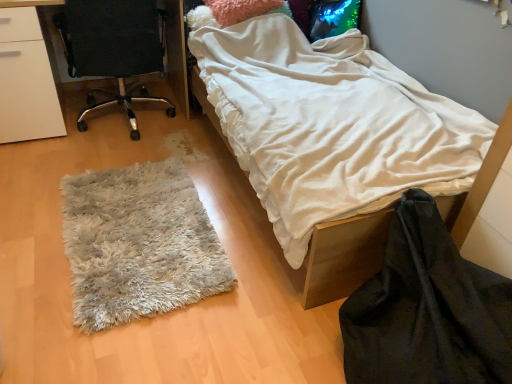
What is the approximate height of white fluffy rug at lower left?

2.91 inches.

Image resolution: width=512 pixels, height=384 pixels. What do you see at coordinates (114, 48) in the screenshot?
I see `black fabric chair at left` at bounding box center [114, 48].

Locate an element on the screen. black velvet blanket at lower right is located at coordinates (426, 310).

Does point (441, 336) lie in front of point (206, 105)?

Yes, it is in front of point (206, 105).

Does black velvet blanket at lower right appear on the left side of white soft blanket at center?

In fact, black velvet blanket at lower right is to the right of white soft blanket at center.

Considering the sizes of objects black velvet blanket at lower right and white soft blanket at center in the image provided, who is thinner, black velvet blanket at lower right or white soft blanket at center?

Thinner between the two is black velvet blanket at lower right.

Looking at this image, which is correct: black velvet blanket at lower right is inside white soft blanket at center, or outside of it?

black velvet blanket at lower right is outside white soft blanket at center.

From a real-world perspective, between white fluffy rug at lower left and white soft blanket at center, who is vertically higher?

From a 3D spatial view, white soft blanket at center is above.

Does white fluffy rug at lower left appear on the right side of white soft blanket at center?

No.

Find the location of a particular element. This screenshot has width=512, height=384. bed above the white fluffy rug at lower left (from a real-world perspective) is located at coordinates (344, 253).

Is black fabric chair at left further to camera compared to black velvet blanket at lower right?

Yes.

Is point (77, 57) farther from camera compared to point (380, 327)?

Yes, it is behind point (380, 327).

Can you confirm if black fabric chair at left is shorter than black velvet blanket at lower right?

No, black fabric chair at left is not shorter than black velvet blanket at lower right.

Is black velvet blanket at lower right inside or outside of black fabric chair at left?

black velvet blanket at lower right is not enclosed by black fabric chair at left.

Which object is closer to the camera taking this photo, black velvet blanket at lower right or black fabric chair at left?

black velvet blanket at lower right is in front.

Is black velvet blanket at lower right thinner than black fabric chair at left?

Yes, black velvet blanket at lower right is thinner than black fabric chair at left.

From the image's perspective, which is below, white fluffy rug at lower left or black velvet blanket at lower right?

black velvet blanket at lower right is shown below in the image.

Considering the positions of objects white fluffy rug at lower left and black velvet blanket at lower right in the image provided, who is behind, white fluffy rug at lower left or black velvet blanket at lower right?

Positioned behind is white fluffy rug at lower left.

Measure the distance from white fluffy rug at lower left to black velvet blanket at lower right.

They are 81.78 centimeters apart.

Is white fluffy rug at lower left bigger than black velvet blanket at lower right?

Incorrect, white fluffy rug at lower left is not larger than black velvet blanket at lower right.

Is black velvet blanket at lower right to the left of white fluffy rug at lower left from the viewer's perspective?

In fact, black velvet blanket at lower right is to the right of white fluffy rug at lower left.

Considering the sizes of objects black velvet blanket at lower right and white fluffy rug at lower left in the image provided, who is bigger, black velvet blanket at lower right or white fluffy rug at lower left?

With larger size is black velvet blanket at lower right.

Identify the location of mat on the left of the black velvet blanket at lower right. The width and height of the screenshot is (512, 384). (138, 244).

From the image's perspective, is black velvet blanket at lower right on top of white fluffy rug at lower left?

No, from the image's perspective, black velvet blanket at lower right is not on top of white fluffy rug at lower left.

Is white soft blanket at center at the left side of black velvet blanket at lower right?

Indeed, white soft blanket at center is positioned on the left side of black velvet blanket at lower right.

In the image, is white soft blanket at center positioned in front of or behind black velvet blanket at lower right?

white soft blanket at center is behind black velvet blanket at lower right.

Looking at their sizes, would you say white soft blanket at center is wider or thinner than black velvet blanket at lower right?

white soft blanket at center is wider than black velvet blanket at lower right.

The height and width of the screenshot is (384, 512). I want to click on blanket that appears below the white soft blanket at center (from a real-world perspective), so click(x=426, y=310).

At what (x,y) coordinates should I click in order to perform the action: click on bed in front of the white fluffy rug at lower left. Please return your answer as a coordinate pair (x, y). Looking at the image, I should click on (344, 253).

Based on their spatial positions, is white soft blanket at center or white fluffy rug at lower left closer to black fabric chair at left?

white fluffy rug at lower left.

Considering their positions, is white fluffy rug at lower left positioned closer to black fabric chair at left than black velvet blanket at lower right?

white fluffy rug at lower left.

Looking at this image, from the image, which object appears to be nearer to black velvet blanket at lower right, white fluffy rug at lower left or black fabric chair at left?

white fluffy rug at lower left is closer to black velvet blanket at lower right.

When comparing their distances from white soft blanket at center, does white fluffy rug at lower left or black velvet blanket at lower right seem further?

Based on the image, white fluffy rug at lower left appears to be further to white soft blanket at center.

Which object lies further to the anchor point black velvet blanket at lower right, white soft blanket at center or white fluffy rug at lower left?

white fluffy rug at lower left.

In the scene shown: From the image, which object appears to be farther from white soft blanket at center, black velvet blanket at lower right or black fabric chair at left?

black fabric chair at left is positioned further to the anchor white soft blanket at center.

Based on their spatial positions, is black fabric chair at left or white fluffy rug at lower left closer to black velvet blanket at lower right?

The object closer to black velvet blanket at lower right is white fluffy rug at lower left.

Considering their positions, is black velvet blanket at lower right positioned closer to white fluffy rug at lower left than black fabric chair at left?

The object closer to white fluffy rug at lower left is black velvet blanket at lower right.

Identify the location of bed situated between black fabric chair at left and black velvet blanket at lower right from left to right. (344, 253).

Where is `mat situated between black fabric chair at left and black velvet blanket at lower right from left to right`? mat situated between black fabric chair at left and black velvet blanket at lower right from left to right is located at coordinates (138, 244).

This screenshot has width=512, height=384. I want to click on mat between black fabric chair at left and white soft blanket at center, so click(138, 244).

Image resolution: width=512 pixels, height=384 pixels. In order to click on bed located between white fluffy rug at lower left and black velvet blanket at lower right in the left-right direction in this screenshot , I will do `click(344, 253)`.